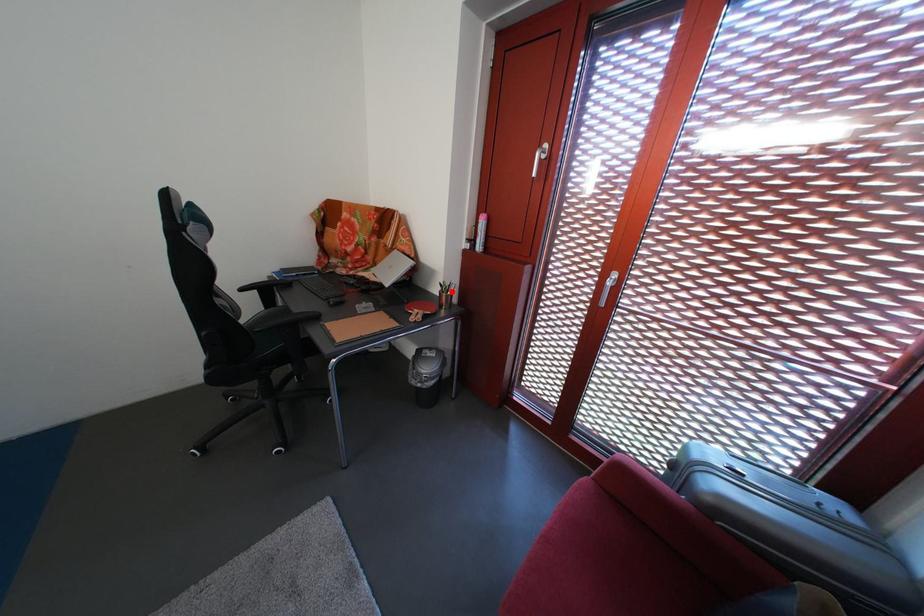
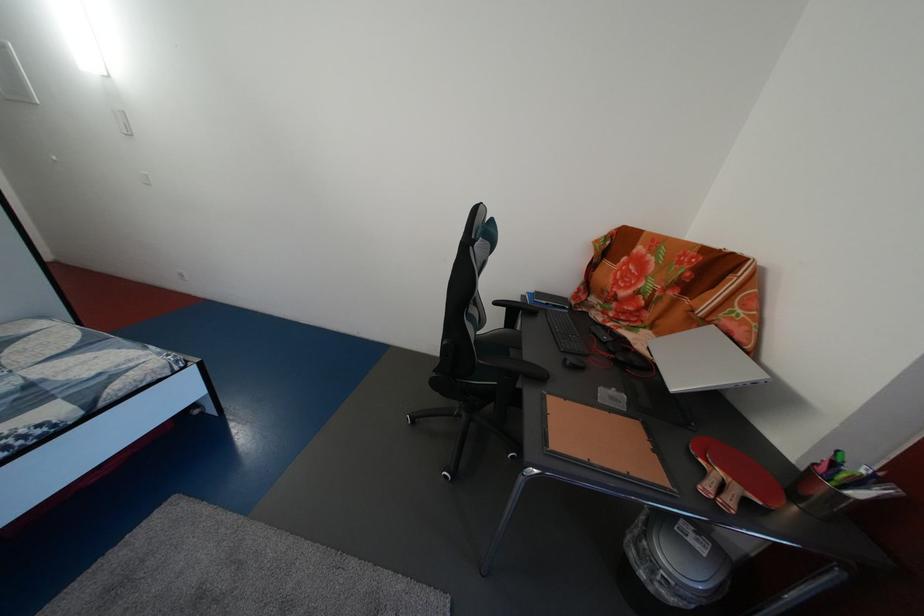
Where in the second image is the point corresponding to the highlighted location from the first image?

(845, 471)